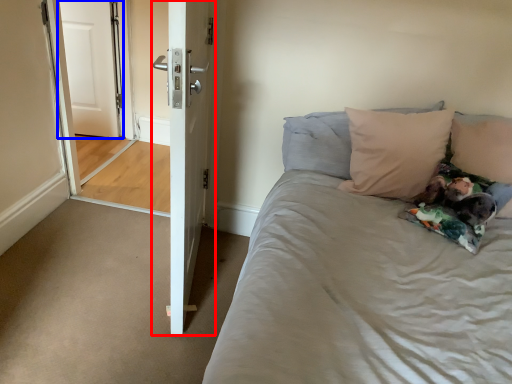
Question: Among these objects, which one is nearest to the camera, door (highlighted by a red box) or door (highlighted by a blue box)?

Choices:
 (A) door
 (B) door

Answer: (A)